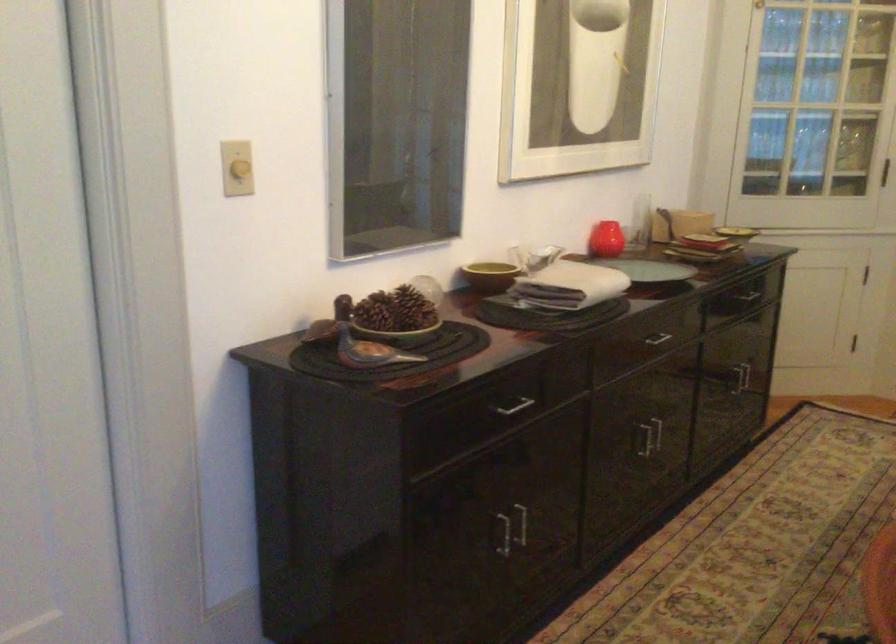
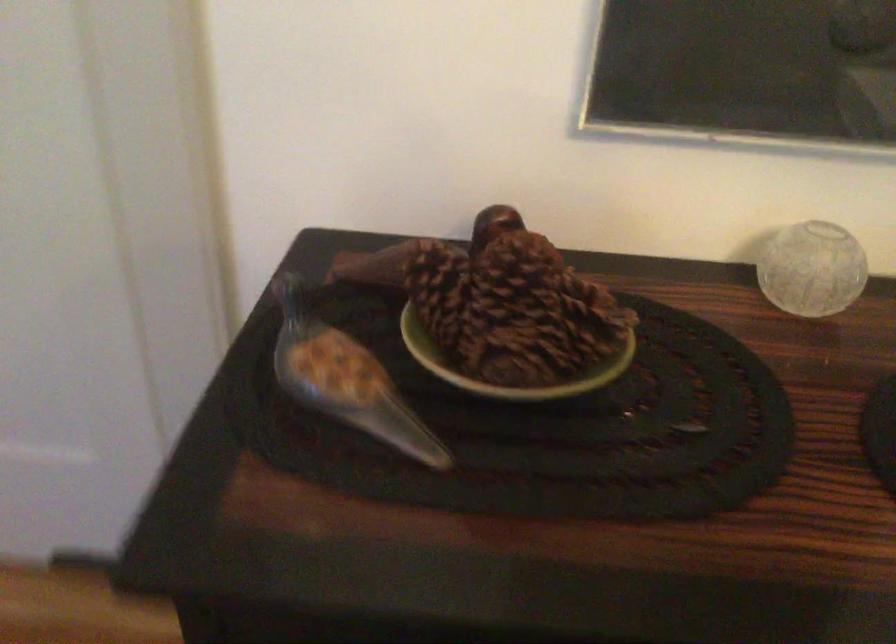
In the second image, find the point that corresponds to pixel 372 344 in the first image.

(347, 386)